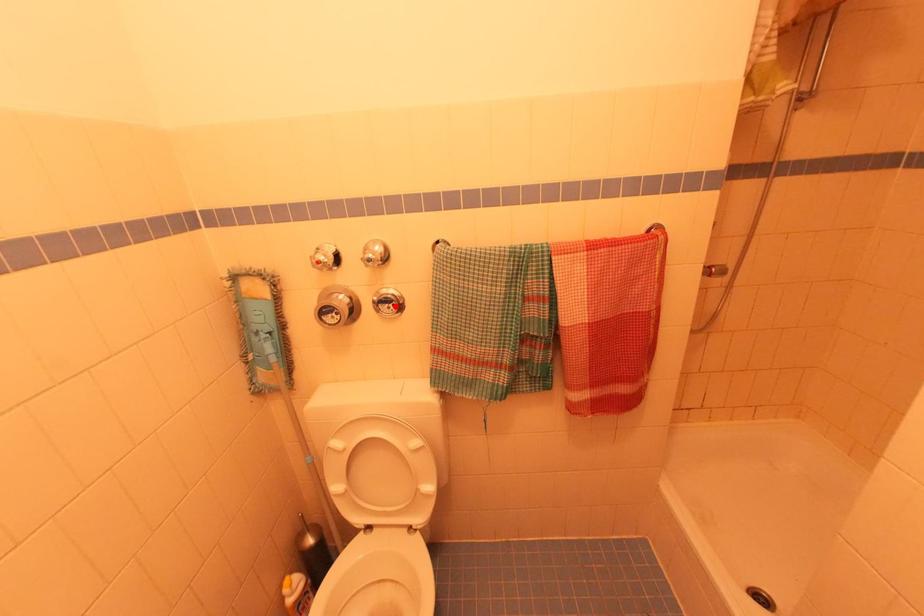
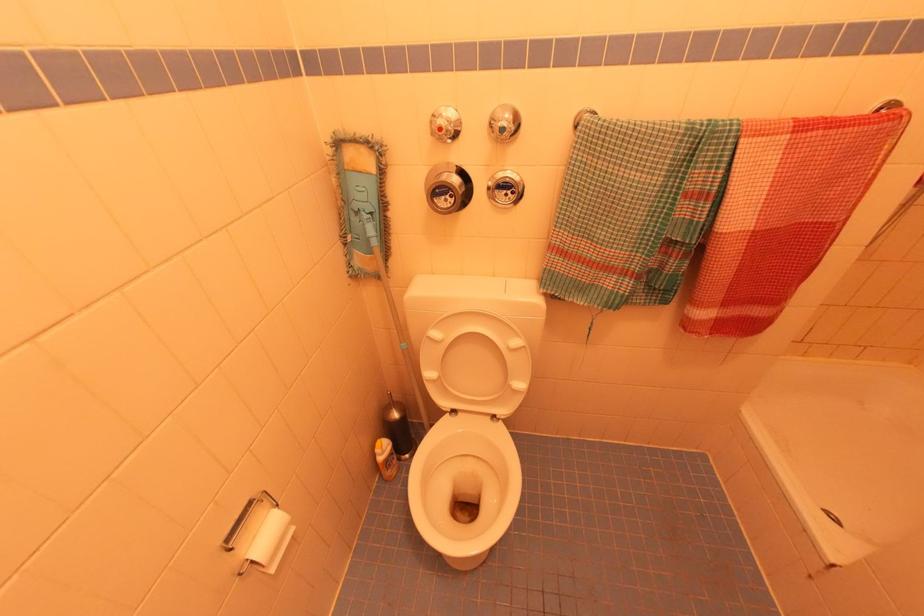
Where in the second image is the point corresponding to the highlighted location from the first image?

(515, 193)